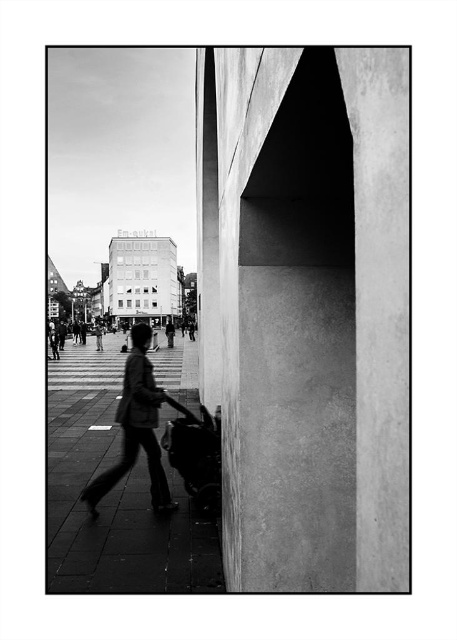
You are a photographer analyzing the composition of this black and white photo. You notice the matte black jacket at center and the metallic smooth baby carriage at center. Which object appears wider in the frame?

The matte black jacket at center appears wider than the metallic smooth baby carriage at center in the frame.

Based on the photo, you are a delivery robot navigating the street scene. You need to deliver a package to the smooth concrete sidewalk at center. The metallic smooth baby carriage at center is blocking your path. Can you move around it to reach the sidewalk?

The smooth concrete sidewalk at center is in front of the metallic smooth baby carriage at center, meaning the sidewalk is closer to you. Since the sidewalk is already in front of the carriage, you don not need to move around the carriage to reach it. You can proceed directly to the sidewalk.